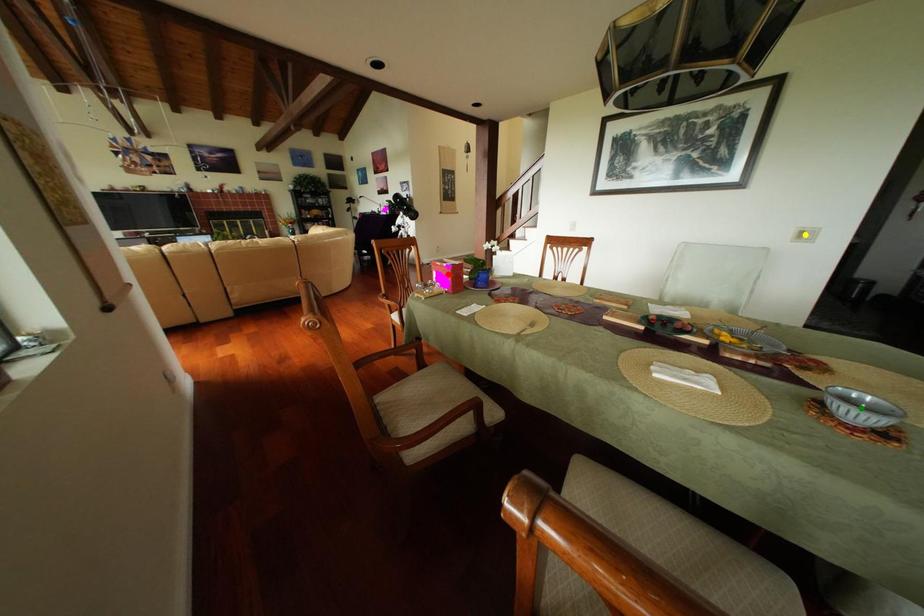
Order these from farthest to nearest:
red point
yellow point
green point

yellow point < red point < green point